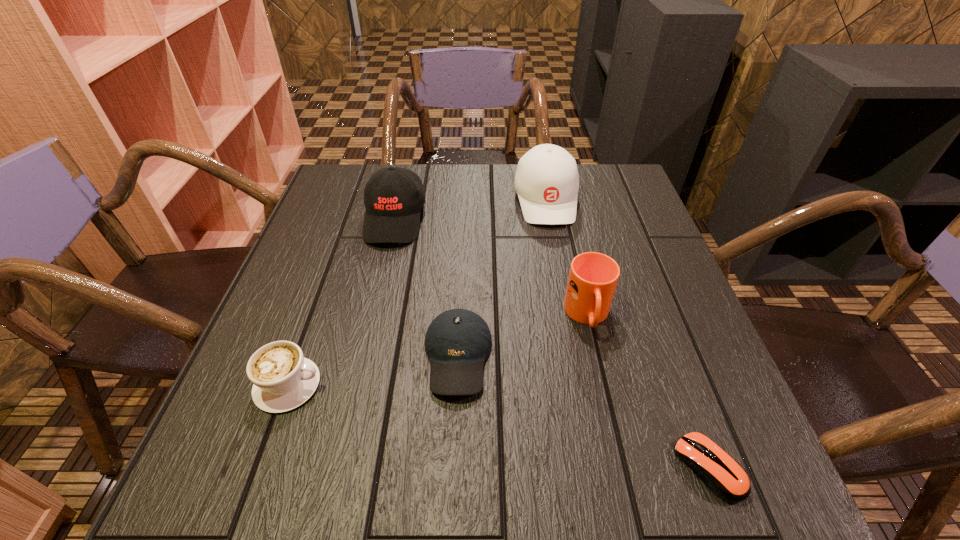
This screenshot has width=960, height=540. I want to click on vacant area at the far edge, so click(x=448, y=204).

At what (x,y) coordinates should I click in order to perform the action: click on free space at the near edge of the desktop. Please return your answer as a coordinate pair (x, y). Looking at the image, I should click on (546, 506).

Where is `vacant space at the left edge`? vacant space at the left edge is located at coordinates (349, 299).

Locate an element on the screen. This screenshot has width=960, height=540. vacant area at the right edge of the desktop is located at coordinates tap(646, 329).

The width and height of the screenshot is (960, 540). In the image, there is a desktop. In order to click on vacant space at the near left corner in this screenshot , I will do `click(299, 463)`.

Locate an element on the screen. This screenshot has height=540, width=960. vacant area at the far right corner of the desktop is located at coordinates (609, 185).

Locate an element on the screen. vacant point located between the rightmost baseball cap and the cappuccino is located at coordinates (418, 292).

You are a GUI agent. You are given a task and a screenshot of the screen. Output one action in this format:
    pyautogui.click(x=<x>, y=<y>)
    Task: Click on the blank region between the second baseball cap from right to left and the leftmost baseball cap
    
    Given the screenshot: What is the action you would take?
    pyautogui.click(x=426, y=288)

At what (x,y) coordinates should I click in order to perform the action: click on free space between the cappuccino and the leftmost baseball cap. Please return your answer as a coordinate pair (x, y). Looking at the image, I should click on (342, 302).

The width and height of the screenshot is (960, 540). I want to click on unoccupied position between the leftmost baseball cap and the second baseball cap from right to left, so click(x=426, y=288).